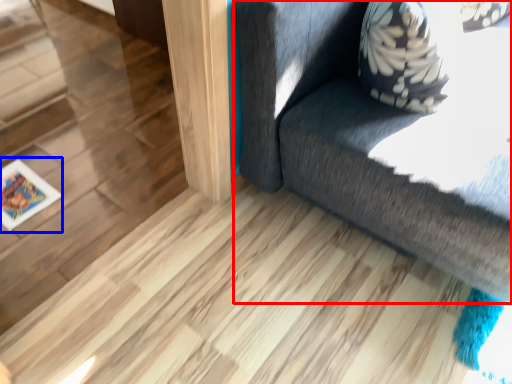
Question: Which object is further to the camera taking this photo, furniture (highlighted by a red box) or picture frame (highlighted by a blue box)?

Choices:
 (A) furniture
 (B) picture frame

Answer: (B)